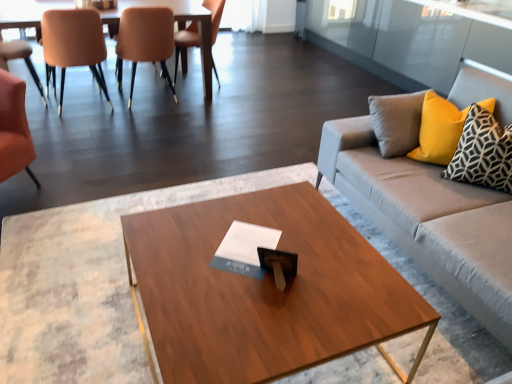
You are a GUI agent. You are given a task and a screenshot of the screen. Output one action in this format:
    pyautogui.click(x=<x>, y=<y>)
    Task: Click on the free location to the right of matte orange chair at left, which is the third chair from right to left
    Image resolution: width=512 pixels, height=384 pixels.
    Given the screenshot: What is the action you would take?
    pyautogui.click(x=133, y=113)